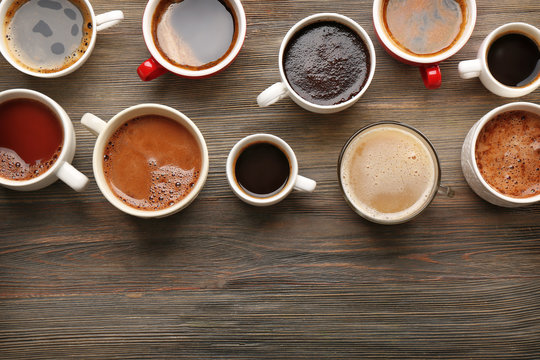
This screenshot has height=360, width=540. I want to click on coffee mugs with beverage, so click(43, 184), click(116, 185), click(263, 194), click(350, 191), click(465, 178), click(495, 81), click(437, 51), click(363, 96), click(190, 51), click(36, 40).